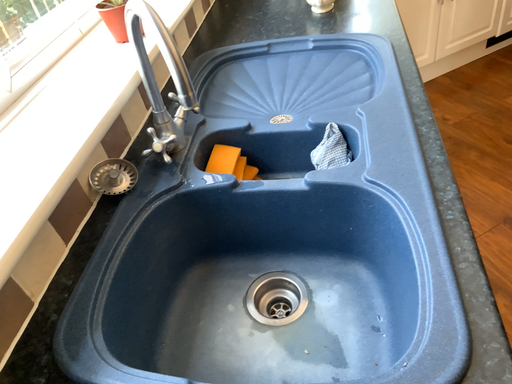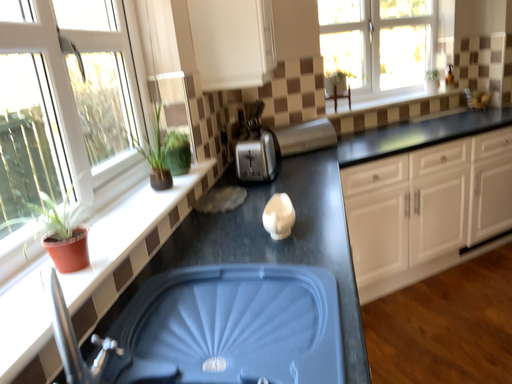
Question: Which way did the camera rotate in the video?

Choices:
 (A) rotated upward
 (B) rotated downward

Answer: (A)